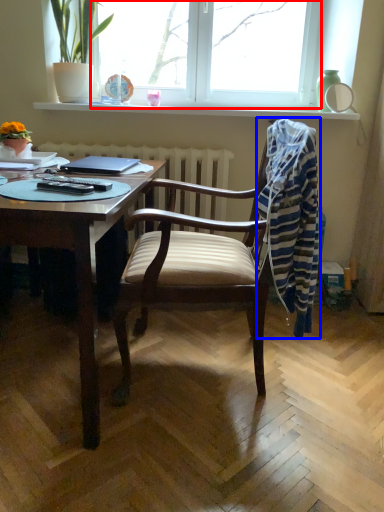
Question: Which object is closer to the camera taking this photo, window (highlighted by a red box) or laundry (highlighted by a blue box)?

Choices:
 (A) window
 (B) laundry

Answer: (B)